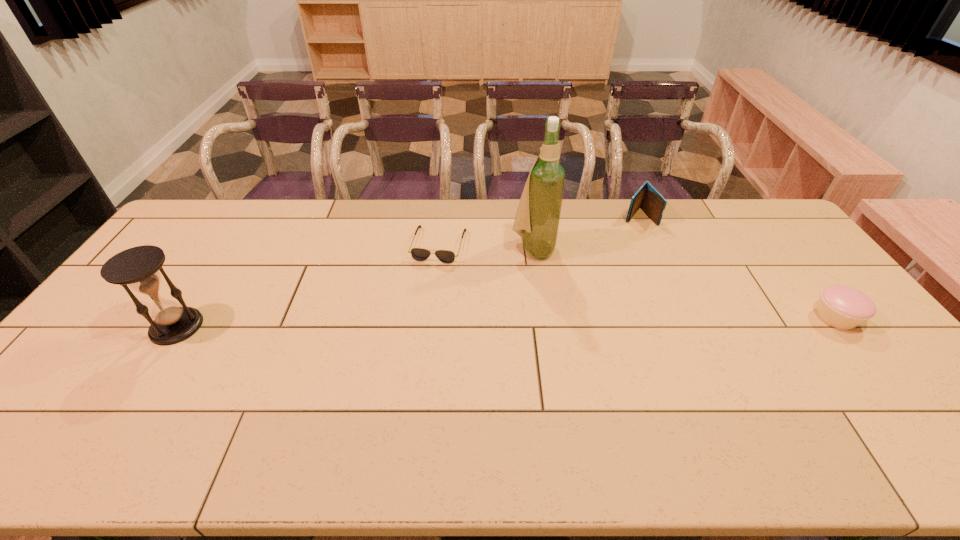
Where is `vacant region that satisfies the following two spatial constraints: 1. on the back side of the sunglasses; 2. on the right side of the third tallest object`? The width and height of the screenshot is (960, 540). vacant region that satisfies the following two spatial constraints: 1. on the back side of the sunglasses; 2. on the right side of the third tallest object is located at coordinates (442, 216).

Image resolution: width=960 pixels, height=540 pixels. Find the location of `free region that satisfies the following two spatial constraints: 1. on the front side of the cupcake; 2. on the left side of the wine bottle`. free region that satisfies the following two spatial constraints: 1. on the front side of the cupcake; 2. on the left side of the wine bottle is located at coordinates (542, 318).

Find the location of `free spot that satisfies the following two spatial constraints: 1. on the back side of the wine bottle; 2. on the right side of the farthest object`. free spot that satisfies the following two spatial constraints: 1. on the back side of the wine bottle; 2. on the right side of the farthest object is located at coordinates (528, 216).